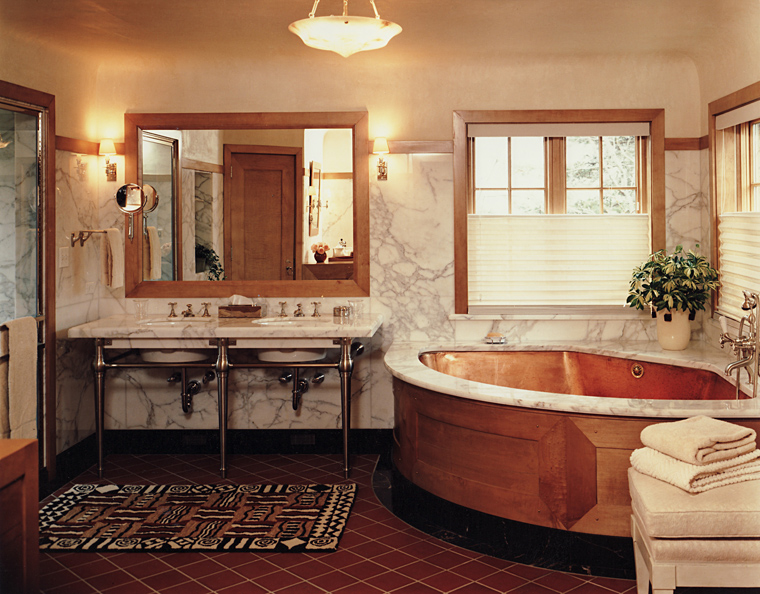
The height and width of the screenshot is (594, 760). What are the coordinates of `the bottom towel` in the screenshot? It's located at (686, 475).